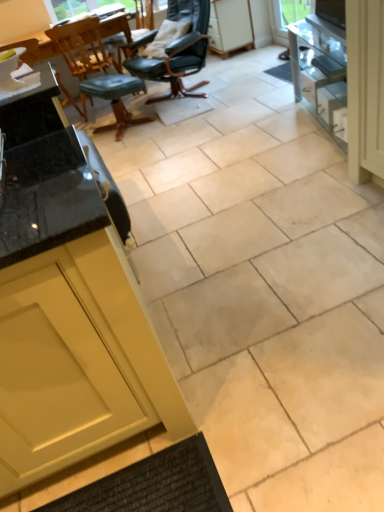
Locate an element on the screen. The image size is (384, 512). green leather stool at center is located at coordinates (113, 99).

This screenshot has width=384, height=512. Describe the element at coordinates (27, 51) in the screenshot. I see `matte black chair at left, the third chair in the right-to-left sequence` at that location.

Find the location of a particular element. Image resolution: width=384 pixels, height=512 pixels. wooden chair at upper left, the second chair positioned from the left is located at coordinates (94, 70).

Find the location of `white matte cabinet at upper center`. white matte cabinet at upper center is located at coordinates (230, 26).

What are the coordinates of `green leather stool at center` in the screenshot? It's located at tap(113, 99).

Between wooden chair at upper left, which is counted as the 2th chair, starting from the right, and green leather stool at center, which one is positioned in front?

Positioned in front is green leather stool at center.

Can you tell me how much wooden chair at upper left, the second chair positioned from the left, and green leather stool at center differ in facing direction?

125 degrees.

Which is closer, (x=61, y=39) or (x=94, y=129)?

Point (x=61, y=39).

Are wooden chair at upper left, which is counted as the 2th chair, starting from the right, and green leather stool at center located far from each other?

No.

Is leather-like black chair at upper center, positioned as the 1th chair in right-to-left order, in front of or behind matte black chair at left, the third chair in the right-to-left sequence, in the image?

In the image, leather-like black chair at upper center, positioned as the 1th chair in right-to-left order, appears in front of matte black chair at left, the third chair in the right-to-left sequence.

Locate an element on the screen. This screenshot has width=384, height=512. chair that is the 2nd object to the right of the matte black chair at left, which is counted as the first chair, starting from the left, starting at the anchor is located at coordinates (178, 52).

Considering the sizes of leather-like black chair at upper center, the 3th chair positioned from the left, and matte black chair at left, which is counted as the first chair, starting from the left, in the image, is leather-like black chair at upper center, the 3th chair positioned from the left, wider or thinner than matte black chair at left, which is counted as the first chair, starting from the left,?

leather-like black chair at upper center, the 3th chair positioned from the left, is wider than matte black chair at left, which is counted as the first chair, starting from the left.

Does leather-like black chair at upper center, positioned as the 1th chair in right-to-left order, turn towards matte black chair at left, the third chair in the right-to-left sequence?

No.

Is matte black chair at left, the third chair in the right-to-left sequence, facing away from white glossy drawer at right?

matte black chair at left, the third chair in the right-to-left sequence, is not turned away from white glossy drawer at right.

Would you say matte black chair at left, which is counted as the first chair, starting from the left, is outside white glossy drawer at right?

That's correct, matte black chair at left, which is counted as the first chair, starting from the left, is outside of white glossy drawer at right.

What's the angular difference between matte black chair at left, the third chair in the right-to-left sequence, and white glossy drawer at right's facing directions?

The angle between the facing direction of matte black chair at left, the third chair in the right-to-left sequence, and the facing direction of white glossy drawer at right is 97.4 degrees.

Where is `drawer below the matte black chair at left, which is counted as the first chair, starting from the left (from a real-world perspective)`? The image size is (384, 512). drawer below the matte black chair at left, which is counted as the first chair, starting from the left (from a real-world perspective) is located at coordinates (324, 99).

From the image's perspective, count 3rd chairs upward from the green leather stool at center and point to it. Please provide its 2D coordinates.

[(178, 52)]

Does green leather stool at center have a lesser width compared to leather-like black chair at upper center, the 3th chair positioned from the left?

Correct, the width of green leather stool at center is less than that of leather-like black chair at upper center, the 3th chair positioned from the left.

From a real-world perspective, is green leather stool at center positioned above or below leather-like black chair at upper center, the 3th chair positioned from the left?

From a real-world perspective, green leather stool at center is physically below leather-like black chair at upper center, the 3th chair positioned from the left.

Based on the photo, from the image's perspective, which object appears higher, green leather stool at center or leather-like black chair at upper center, the 3th chair positioned from the left?

leather-like black chair at upper center, the 3th chair positioned from the left, appears higher in the image.

Would you say matte black chair at left, which is counted as the first chair, starting from the left, is to the left or to the right of leather-like black chair at upper center, the 3th chair positioned from the left, in the picture?

matte black chair at left, which is counted as the first chair, starting from the left, is to the left of leather-like black chair at upper center, the 3th chair positioned from the left.

Would you say matte black chair at left, which is counted as the first chair, starting from the left, is inside or outside leather-like black chair at upper center, positioned as the 1th chair in right-to-left order?

matte black chair at left, which is counted as the first chair, starting from the left, is not enclosed by leather-like black chair at upper center, positioned as the 1th chair in right-to-left order.

Which object is thinner, matte black chair at left, the third chair in the right-to-left sequence, or leather-like black chair at upper center, positioned as the 1th chair in right-to-left order?

Thinner between the two is matte black chair at left, the third chair in the right-to-left sequence.

Is matte black chair at left, which is counted as the first chair, starting from the left, behind leather-like black chair at upper center, positioned as the 1th chair in right-to-left order?

Yes, matte black chair at left, which is counted as the first chair, starting from the left, is behind leather-like black chair at upper center, positioned as the 1th chair in right-to-left order.

From a real-world perspective, is wooden chair at upper left, which is counted as the 2th chair, starting from the right, positioned above or below matte black chair at left, which is counted as the first chair, starting from the left?

wooden chair at upper left, which is counted as the 2th chair, starting from the right, is below matte black chair at left, which is counted as the first chair, starting from the left.

Does point (60, 44) appear closer or farther from the camera than point (66, 99)?

Point (60, 44) is closer to the camera than point (66, 99).

Which of these two, wooden chair at upper left, which is counted as the 2th chair, starting from the right, or matte black chair at left, which is counted as the first chair, starting from the left, is bigger?

Bigger between the two is wooden chair at upper left, which is counted as the 2th chair, starting from the right.

Image resolution: width=384 pixels, height=512 pixels. In order to click on drawer on the right of the green leather stool at center in this screenshot , I will do `click(324, 99)`.

From the image's perspective, is green leather stool at center over white glossy drawer at right?

Yes, from the image's perspective, green leather stool at center is over white glossy drawer at right.

Who is taller, green leather stool at center or white glossy drawer at right?

green leather stool at center is taller.

Locate an element on the screen. This screenshot has width=384, height=512. stool that appears below the wooden chair at upper left, which is counted as the 2th chair, starting from the right (from the image's perspective) is located at coordinates (x=113, y=99).

From a real-world perspective, starting from the leather-like black chair at upper center, positioned as the 1th chair in right-to-left order, which chair is the 1st one below it? Please provide its 2D coordinates.

[(27, 51)]

From the image, which object appears to be nearer to matte black chair at left, which is counted as the first chair, starting from the left, white matte cabinet at upper center or white glossy drawer at right?

Among the two, white matte cabinet at upper center is located nearer to matte black chair at left, which is counted as the first chair, starting from the left.

Estimate the real-world distances between objects in this image. Which object is further from green leather stool at center, leather-like black chair at upper center, the 3th chair positioned from the left, or white glossy drawer at right?

white glossy drawer at right lies further to green leather stool at center than the other object.

Considering their positions, is matte black chair at left, which is counted as the first chair, starting from the left, positioned further to white glossy drawer at right than wooden chair at upper left, the second chair positioned from the left?

matte black chair at left, which is counted as the first chair, starting from the left, is further to white glossy drawer at right.

From the image, which object appears to be farther from white matte cabinet at upper center, wooden chair at upper left, which is counted as the 2th chair, starting from the right, or green leather stool at center?

green leather stool at center lies further to white matte cabinet at upper center than the other object.

Looking at the image, which one is located further to white glossy drawer at right, white matte cabinet at upper center or leather-like black chair at upper center, the 3th chair positioned from the left?

white matte cabinet at upper center lies further to white glossy drawer at right than the other object.

From the image, which object appears to be farther from green leather stool at center, white matte cabinet at upper center or wooden chair at upper left, the second chair positioned from the left?

Among the two, white matte cabinet at upper center is located further to green leather stool at center.

Which object lies further to the anchor point white glossy drawer at right, matte black chair at left, which is counted as the first chair, starting from the left, or white matte cabinet at upper center?

matte black chair at left, which is counted as the first chair, starting from the left, lies further to white glossy drawer at right than the other object.

When comparing their distances from leather-like black chair at upper center, positioned as the 1th chair in right-to-left order, does green leather stool at center or wooden chair at upper left, which is counted as the 2th chair, starting from the right, seem further?

Among the two, wooden chair at upper left, which is counted as the 2th chair, starting from the right, is located further to leather-like black chair at upper center, positioned as the 1th chair in right-to-left order.

At what (x,y) coordinates should I click in order to perform the action: click on stool between wooden chair at upper left, which is counted as the 2th chair, starting from the right, and white matte cabinet at upper center. Please return your answer as a coordinate pair (x, y). This screenshot has height=512, width=384. Looking at the image, I should click on (113, 99).

Find the location of `stool between white glossy drawer at right and white matte cabinet at upper center from front to back`. stool between white glossy drawer at right and white matte cabinet at upper center from front to back is located at coordinates (113, 99).

Where is `stool between leather-like black chair at upper center, the 3th chair positioned from the left, and white matte cabinet at upper center, along the z-axis`? This screenshot has height=512, width=384. stool between leather-like black chair at upper center, the 3th chair positioned from the left, and white matte cabinet at upper center, along the z-axis is located at coordinates (113, 99).

Image resolution: width=384 pixels, height=512 pixels. I want to click on stool located between matte black chair at left, the third chair in the right-to-left sequence, and white matte cabinet at upper center in the left-right direction, so click(113, 99).